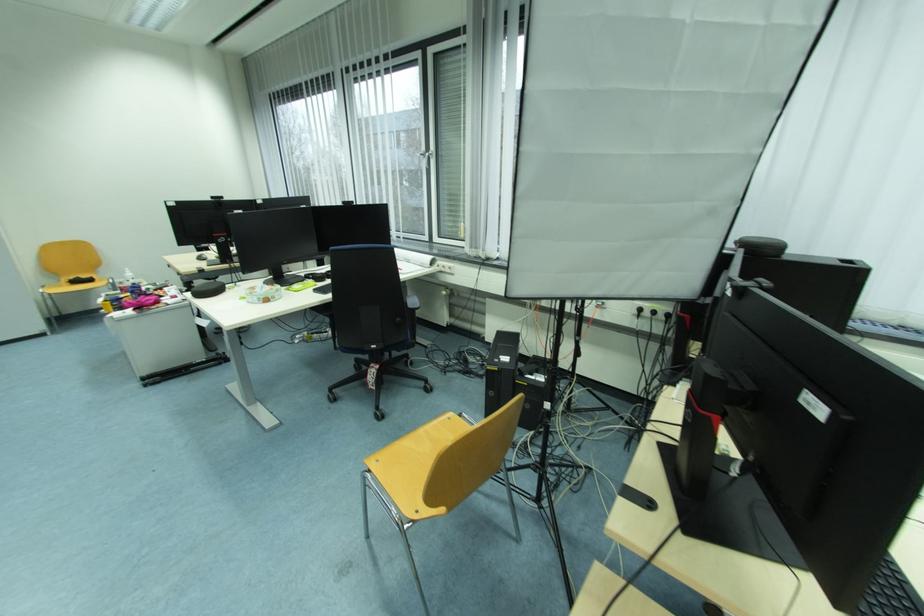
What do you see at coordinates (415, 456) in the screenshot?
I see `a wooden chair sitting surface` at bounding box center [415, 456].